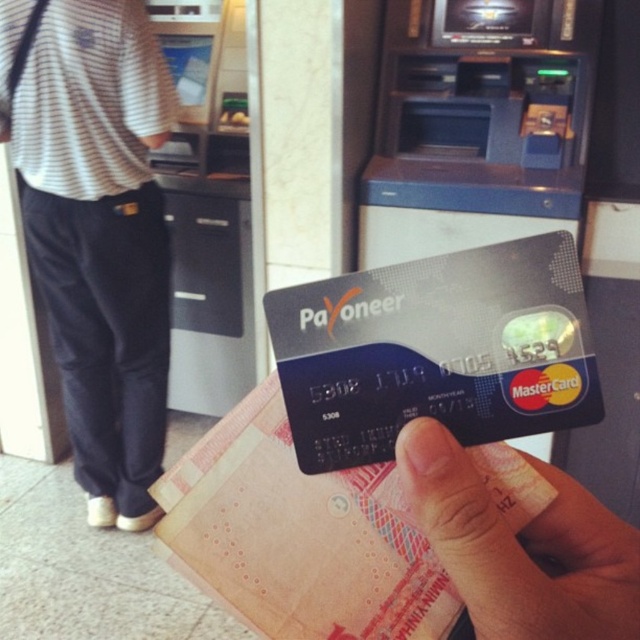
Can you confirm if striped cotton shirt at upper left is positioned below smooth skin hand at center?

Actually, striped cotton shirt at upper left is above smooth skin hand at center.

Does striped cotton shirt at upper left have a greater height compared to smooth skin hand at center?

Yes.

Is point (141, 58) positioned after point (547, 550)?

That is True.

Find the location of a particular element. Image resolution: width=640 pixels, height=640 pixels. striped cotton shirt at upper left is located at coordinates (97, 232).